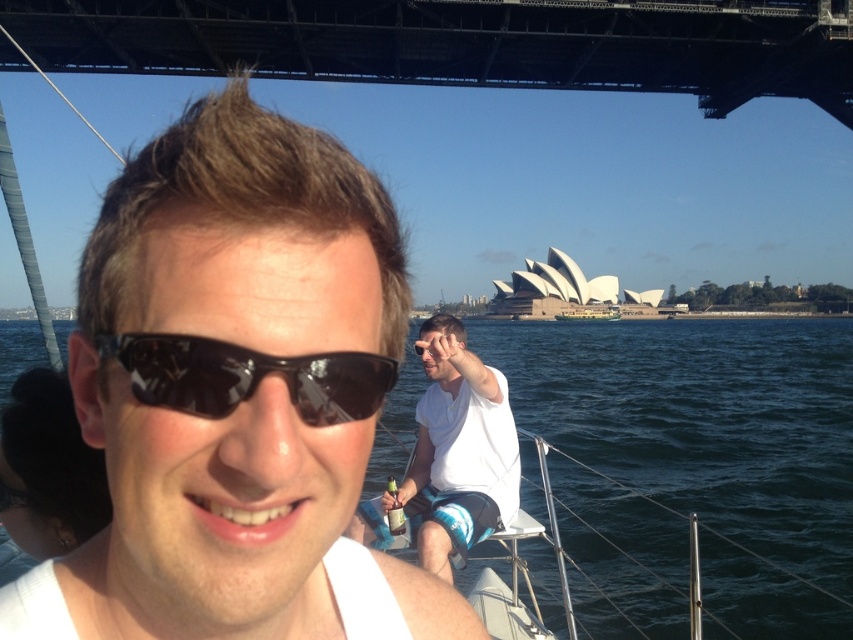
Does dark blue water at center come behind black reflective sunglasses at center?

Yes, it is.

Who is shorter, dark blue water at center or black reflective sunglasses at center?

Standing shorter between the two is black reflective sunglasses at center.

Describe the element at coordinates (697, 461) in the screenshot. I see `dark blue water at center` at that location.

Locate an element on the screen. dark blue water at center is located at coordinates (697, 461).

Is matte black sunglasses at center to the right of white cotton shirt at center from the viewer's perspective?

No, matte black sunglasses at center is not to the right of white cotton shirt at center.

Between point (99, 422) and point (474, 490), which one is positioned in front?

Point (99, 422)

Where is `matte black sunglasses at center`? The image size is (853, 640). matte black sunglasses at center is located at coordinates (234, 394).

Between point (431, 484) and point (318, 388), which one is positioned in front?

Point (318, 388)

Is point (476, 460) farther from viewer compared to point (380, 360)?

Yes, point (476, 460) is behind point (380, 360).

Is point (422, 502) positioned before point (241, 356)?

No, it is behind (241, 356).

Where is `white cotton shirt at center`? Image resolution: width=853 pixels, height=640 pixels. white cotton shirt at center is located at coordinates (451, 456).